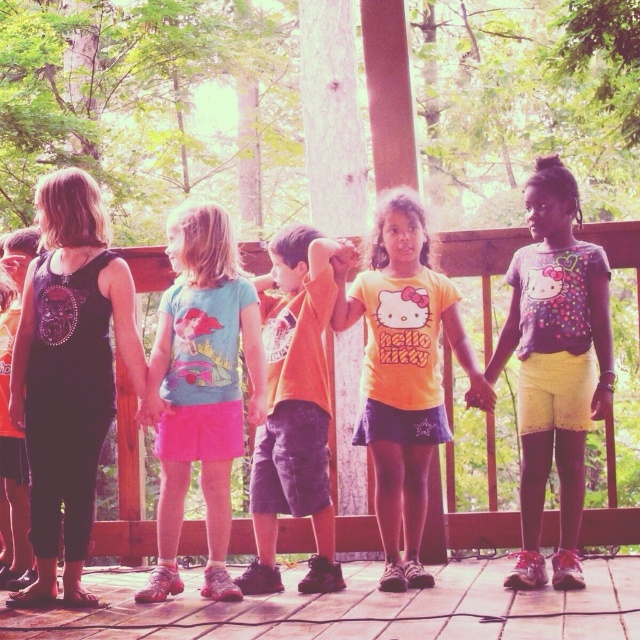
Who is higher up, brown wooden deck at lower center or yellow matte shirt at center?

yellow matte shirt at center is higher up.

What do you see at coordinates (364, 609) in the screenshot?
I see `brown wooden deck at lower center` at bounding box center [364, 609].

Locate an element on the screen. The image size is (640, 640). brown wooden deck at lower center is located at coordinates (364, 609).

Is black matte tank top at left to the left of matte pink skirt at center from the viewer's perspective?

Correct, you'll find black matte tank top at left to the left of matte pink skirt at center.

Does black matte tank top at left have a smaller size compared to matte pink skirt at center?

Yes.

Is point (100, 371) positioned behind point (232, 304)?

No.

Locate an element on the screen. Image resolution: width=640 pixels, height=640 pixels. black matte tank top at left is located at coordinates (x=68, y=374).

How much distance is there between brown wooden deck at lower center and matte pink skirt at center?

brown wooden deck at lower center is 3.25 meters away from matte pink skirt at center.

Between point (349, 584) and point (172, 404), which one is positioned behind?

The point (349, 584) is behind.

Locate an element on the screen. This screenshot has height=640, width=640. brown wooden deck at lower center is located at coordinates (364, 609).